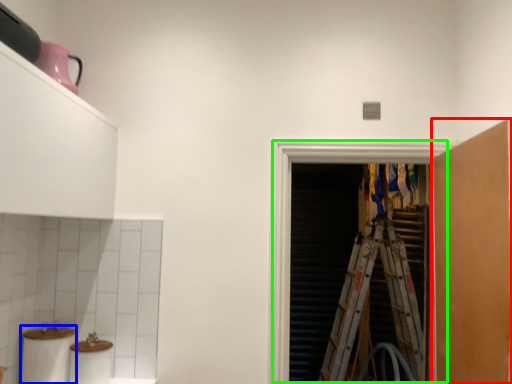
Question: Considering the real-world distances, which object is closest to cabinetry (highlighted by a red box)? toilet paper (highlighted by a blue box) or screen door (highlighted by a green box).

Choices:
 (A) toilet paper
 (B) screen door

Answer: (B)